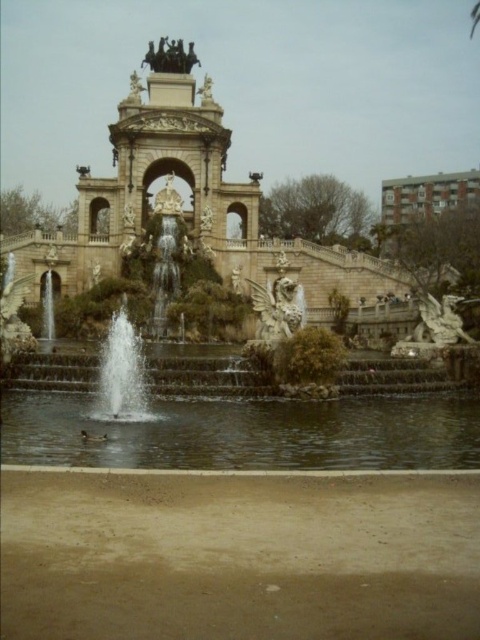
Question: Does stone fountain at center have a smaller size compared to white marble statue at center?

Choices:
 (A) yes
 (B) no

Answer: (B)

Question: Estimate the real-world distances between objects in this image. Which object is closer to the clear water fountain at center?

Choices:
 (A) bronze statue at upper center
 (B) gold ornate archway at center
 (C) white stone archway at center
 (D) white marble statue at center

Answer: (D)

Question: Is clear water fountain at center smaller than bronze statue at upper center?

Choices:
 (A) yes
 (B) no

Answer: (B)

Question: Does clear water fountain at center appear on the left side of gold ornate archway at center?

Choices:
 (A) yes
 (B) no

Answer: (A)

Question: Which point is closer to the camera taking this photo?

Choices:
 (A) (129, 371)
 (B) (169, 45)

Answer: (A)

Question: Which of these objects is positioned farthest from the clear water at center?

Choices:
 (A) stone fountain at center
 (B) clear water fountain at center

Answer: (A)